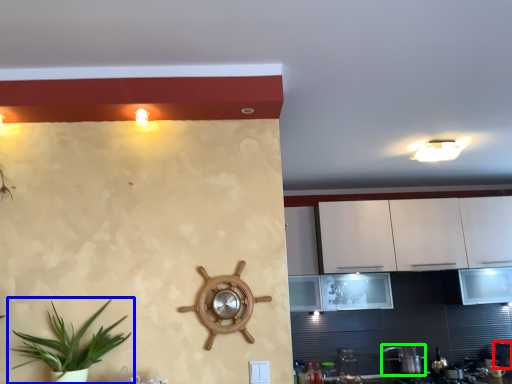
Question: Which object is positioned farthest from appliance (highlighted by a red box)? Select from houseplant (highlighted by a blue box) and appliance (highlighted by a green box).

Choices:
 (A) houseplant
 (B) appliance

Answer: (A)